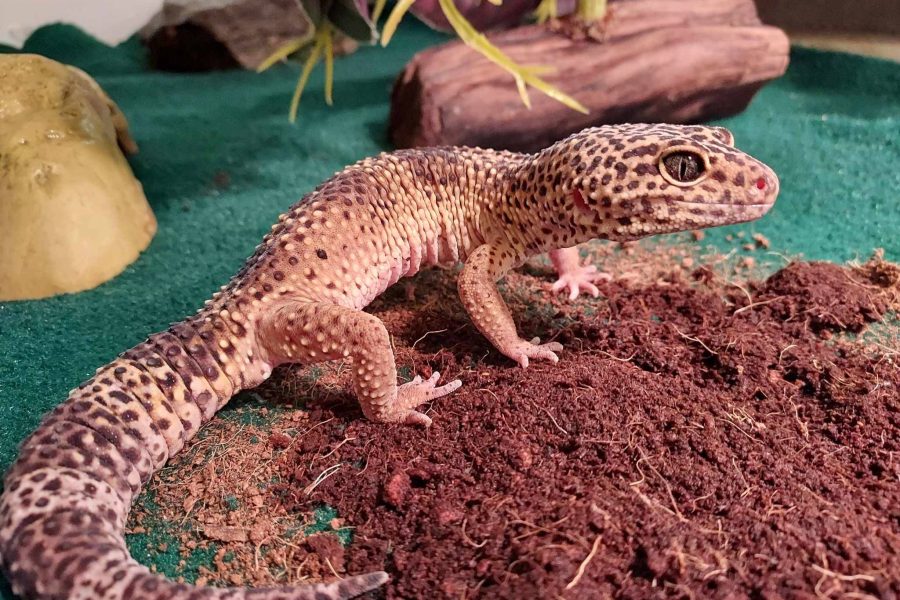
Identify the location of left front leg. The width and height of the screenshot is (900, 600). (565, 258).